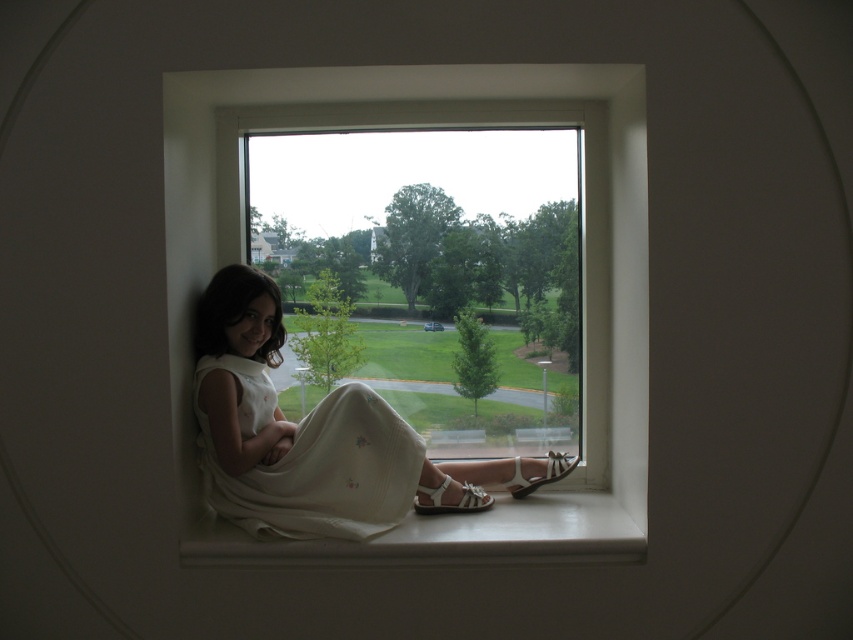
You are a painter standing in front of the scene. You want to paint the white plastic window at center and the white cotton dress at lower left. Which object is placed higher in the image?

The white plastic window at center is positioned over the white cotton dress at lower left, so it is higher in the image.

You are an architect designing a new building and want to ensure that the white plastic window at center provides a view of the lush green landscape outside. Based on its position, can you confirm if the window is placed in an area that would allow this view?

The white plastic window at center is located at point (583, 266), which is within the frame of the circular window that overlooks the lush green landscape outside. Therefore, the window is positioned to provide a clear view of the garden or park scenery described in the scene.